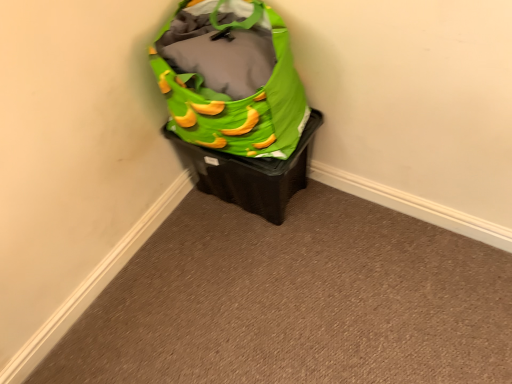
This screenshot has width=512, height=384. In order to click on green fabric bag at upper center in this screenshot , I will do `click(296, 302)`.

What is the approximate width of green fabric bag at upper center?

It is 3.99 feet.

Where is `green fabric bag at upper right`? green fabric bag at upper right is located at coordinates (252, 174).

Does green fabric bag at upper center have a larger size compared to green fabric bag at upper right?

Incorrect, green fabric bag at upper center is not larger than green fabric bag at upper right.

Looking at this image, is green fabric bag at upper center far away from green fabric bag at upper right?

No, green fabric bag at upper center is in close proximity to green fabric bag at upper right.

Can you confirm if green fabric bag at upper center is positioned to the right of green fabric bag at upper right?

Correct, you'll find green fabric bag at upper center to the right of green fabric bag at upper right.

Does green fabric bag at upper center come behind green fabric bag at upper right?

That is False.

Is green fabric bag at upper right inside green fabric bag at upper right?

No, green fabric bag at upper right is not inside green fabric bag at upper right.

From a real-world perspective, between green fabric bag at upper right and green fabric bag at upper right, who is vertically higher?

From a 3D spatial view, green fabric bag at upper right is above.

Who is taller, green fabric bag at upper right or green fabric bag at upper right?

With more height is green fabric bag at upper right.

Could you tell me if green fabric bag at upper right is turned towards green fabric bag at upper center?

No, green fabric bag at upper right is not aimed at green fabric bag at upper center.

Is point (302, 152) closer or farther from the camera than point (444, 340)?

Point (302, 152) appears to be farther away from the viewer than point (444, 340).

Is green fabric bag at upper right thinner than green fabric bag at upper center?

Yes, green fabric bag at upper right is thinner than green fabric bag at upper center.

Considering the sizes of objects green fabric bag at upper right and green fabric bag at upper center in the image provided, who is smaller, green fabric bag at upper right or green fabric bag at upper center?

Smaller between the two is green fabric bag at upper center.

This screenshot has height=384, width=512. I want to click on plain on the right of green fabric bag at upper right, so pyautogui.click(x=296, y=302).

Is the position of green fabric bag at upper right less distant than that of green fabric bag at upper center?

No, green fabric bag at upper right is further to the viewer.

From a real-world perspective, is green fabric bag at upper right over green fabric bag at upper right?

Actually, green fabric bag at upper right is physically below green fabric bag at upper right in the real world.

Does green fabric bag at upper right have a lesser height compared to green fabric bag at upper right?

Yes, green fabric bag at upper right is shorter than green fabric bag at upper right.

Between green fabric bag at upper right and green fabric bag at upper right, which one appears on the right side from the viewer's perspective?

From the viewer's perspective, green fabric bag at upper right appears more on the right side.

Do you think green fabric bag at upper right is within green fabric bag at upper right, or outside of it?

green fabric bag at upper right is outside green fabric bag at upper right.

Is green fabric bag at upper center shorter than green fabric bag at upper right?

Yes, green fabric bag at upper center is shorter than green fabric bag at upper right.

Between green fabric bag at upper center and green fabric bag at upper right, which one appears on the right side from the viewer's perspective?

green fabric bag at upper center.

From the picture: Measure the distance between green fabric bag at upper center and green fabric bag at upper right.

A distance of 13.72 inches exists between green fabric bag at upper center and green fabric bag at upper right.

In the image, there is a green fabric bag at upper right. Where is `plain below it (from the image's perspective)`? This screenshot has width=512, height=384. plain below it (from the image's perspective) is located at coordinates (296, 302).

Where is `luggage and bags in front of the green fabric bag at upper right`? This screenshot has height=384, width=512. luggage and bags in front of the green fabric bag at upper right is located at coordinates (231, 78).

When comparing their distances from green fabric bag at upper center, does green fabric bag at upper right or green fabric bag at upper right seem closer?

The object closer to green fabric bag at upper center is green fabric bag at upper right.

When comparing their distances from green fabric bag at upper right, does green fabric bag at upper center or green fabric bag at upper right seem further?

Based on the image, green fabric bag at upper center appears to be further to green fabric bag at upper right.

Based on their spatial positions, is green fabric bag at upper right or green fabric bag at upper center closer to green fabric bag at upper right?

The object closer to green fabric bag at upper right is green fabric bag at upper right.

Looking at the image, which one is located closer to green fabric bag at upper right, green fabric bag at upper right or green fabric bag at upper center?

Based on the image, green fabric bag at upper right appears to be nearer to green fabric bag at upper right.

Looking at this image, considering their positions, is green fabric bag at upper right positioned closer to green fabric bag at upper center than green fabric bag at upper right?

Based on the image, green fabric bag at upper right appears to be nearer to green fabric bag at upper center.

Based on their spatial positions, is green fabric bag at upper center or green fabric bag at upper right further from green fabric bag at upper right?

Based on the image, green fabric bag at upper center appears to be further to green fabric bag at upper right.

Find the location of a particular element. waste container between green fabric bag at upper right and green fabric bag at upper center in the up-down direction is located at coordinates (252, 174).